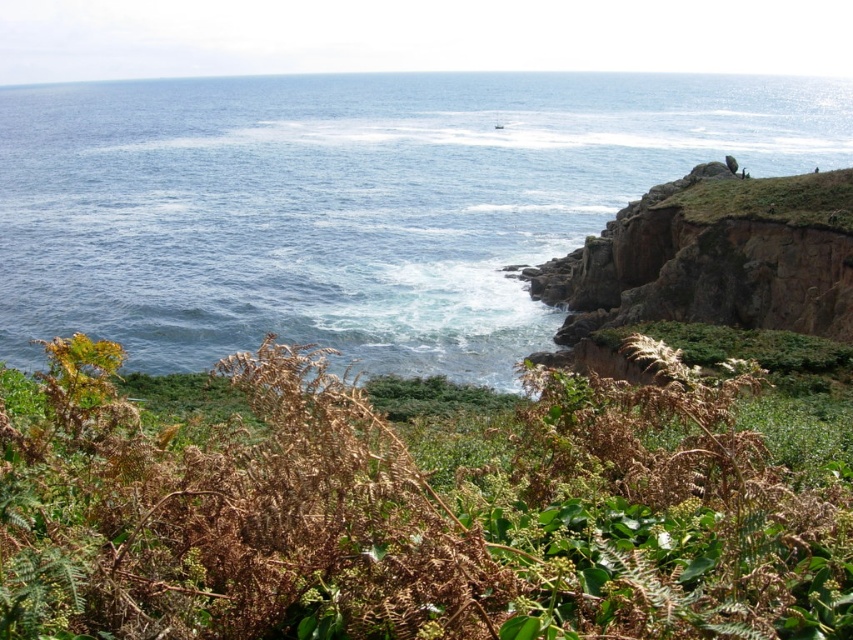
Is brown dried leaves at lower center wider than brown rocky cliff at upper right?

No, brown dried leaves at lower center is not wider than brown rocky cliff at upper right.

Who is more distant from viewer, [160,445] or [695,228]?

Point [695,228]

Does point (109, 600) lie in front of point (688, 275)?

Yes, it is in front of point (688, 275).

The image size is (853, 640). Identify the location of brown dried leaves at lower center. (405, 515).

Which is more to the left, blue water at center or brown rocky cliff at upper right?

Positioned to the left is blue water at center.

Who is more distant from viewer, (341, 275) or (656, 225)?

The point (341, 275) is behind.

I want to click on blue water at center, so click(x=352, y=204).

Find the location of a particular element. This screenshot has height=640, width=853. blue water at center is located at coordinates (352, 204).

Is point (550, 429) less distant than point (389, 120)?

Yes, it is.

Is brown dried leaves at lower center above blue water at center?

Actually, brown dried leaves at lower center is below blue water at center.

This screenshot has height=640, width=853. I want to click on brown dried leaves at lower center, so click(405, 515).